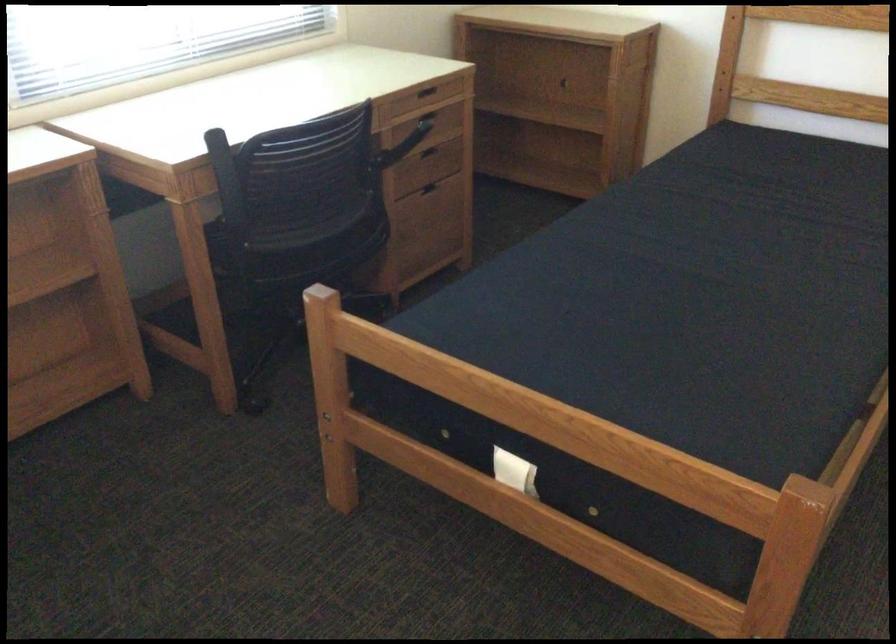
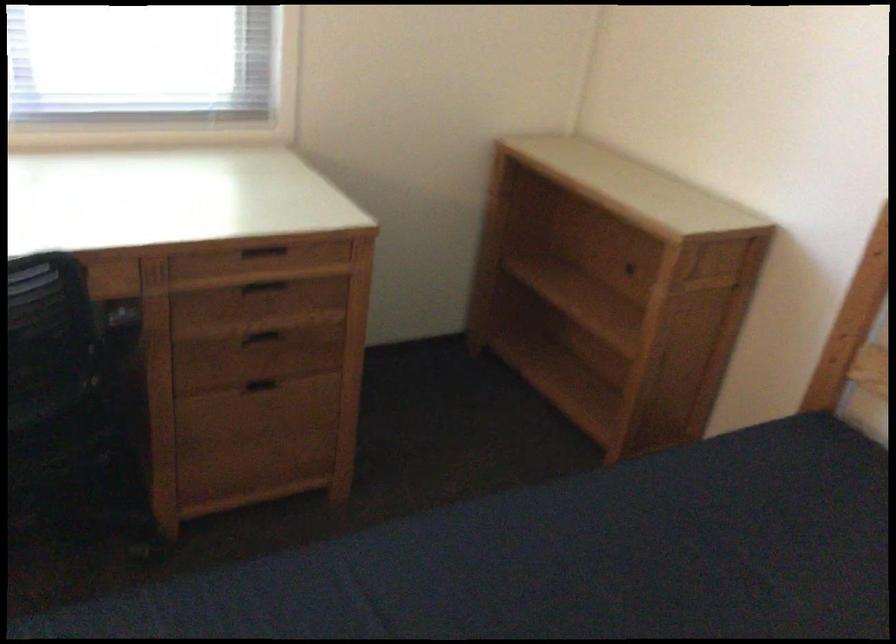
In a continuous first-person perspective shot, in which direction is the camera moving?

The cameraman moved toward right, forward.